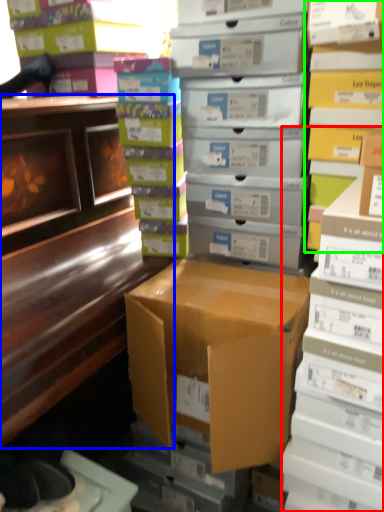
Question: Which is farther away from book (highlighted by a red box)? desk (highlighted by a blue box) or shelf (highlighted by a green box)?

Choices:
 (A) desk
 (B) shelf

Answer: (A)